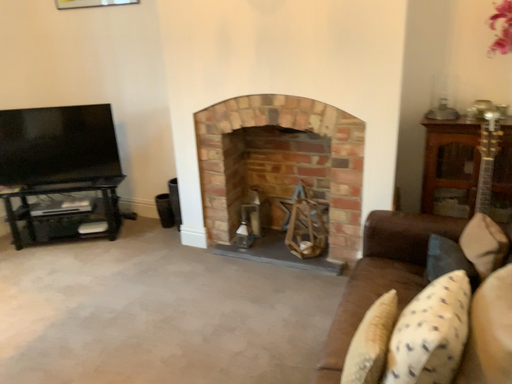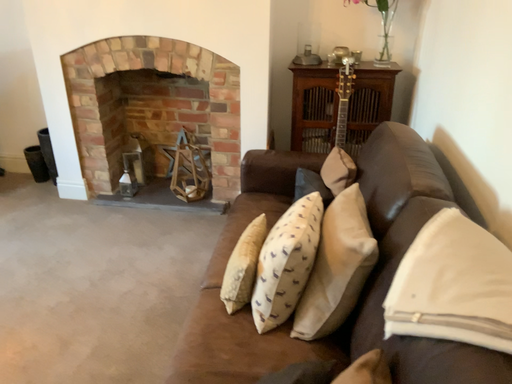
Question: How did the camera likely rotate when shooting the video?

Choices:
 (A) rotated left
 (B) rotated right

Answer: (B)